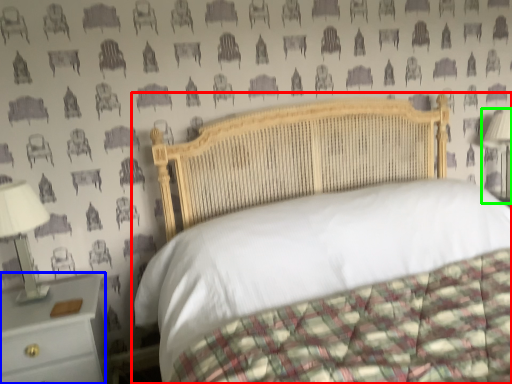
Question: Based on their relative distances, which object is nearer to bed (highlighted by a red box)? Choose from nightstand (highlighted by a blue box) and bedside lamp (highlighted by a green box).

Choices:
 (A) nightstand
 (B) bedside lamp

Answer: (A)